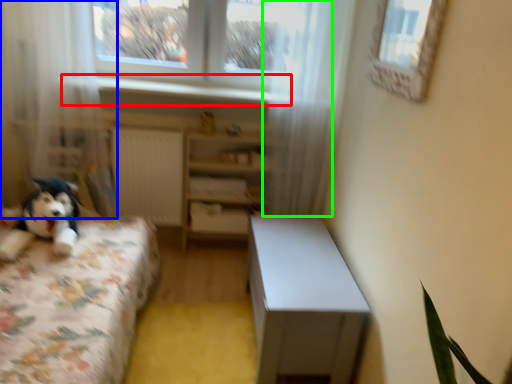
Question: Considering the real-world distances, which object is closest to window sill (highlighted by a red box)? curtain (highlighted by a blue box) or curtain (highlighted by a green box).

Choices:
 (A) curtain
 (B) curtain

Answer: (A)